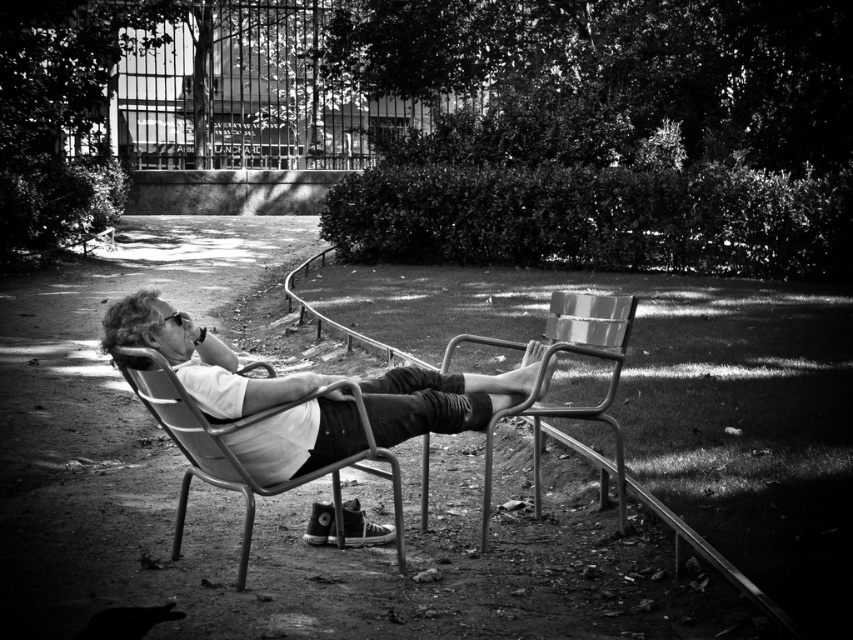
Question: Does metallic silver chair at center have a smaller size compared to metallic frame chair at center?

Choices:
 (A) no
 (B) yes

Answer: (A)

Question: Which point appears farthest from the camera in this image?

Choices:
 (A) (584, 353)
 (B) (251, 518)

Answer: (A)

Question: Which point is closer to the camera?

Choices:
 (A) (229, 432)
 (B) (612, 337)

Answer: (A)

Question: Is metallic silver chair at center further to the viewer compared to metallic silver beach chair at center?

Choices:
 (A) yes
 (B) no

Answer: (B)

Question: Can you confirm if metallic frame chair at center is positioned above metallic silver beach chair at center?

Choices:
 (A) yes
 (B) no

Answer: (B)

Question: Estimate the real-world distances between objects in this image. Which object is farther from the metallic silver chair at center?

Choices:
 (A) metallic frame chair at center
 (B) metallic silver beach chair at center

Answer: (B)